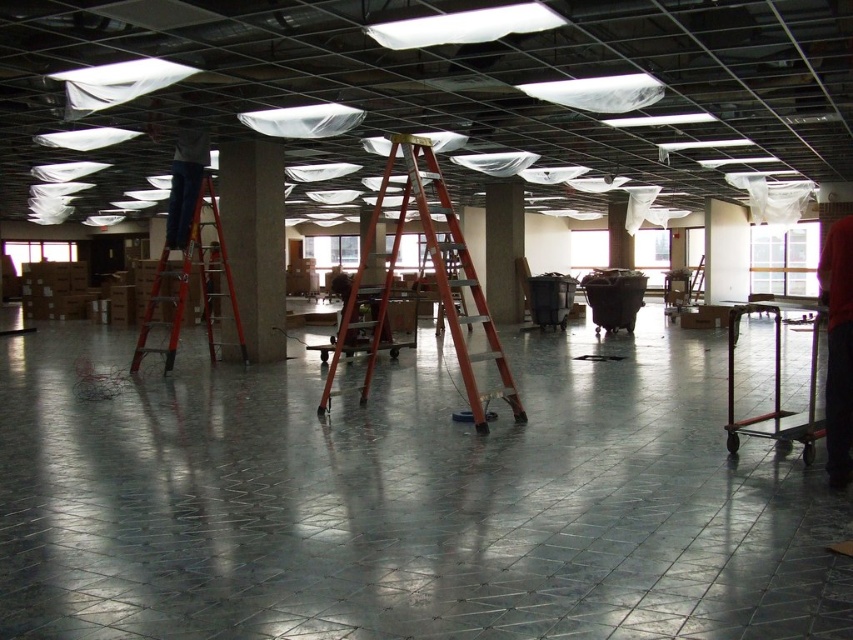
Question: Which point is closer to the camera?

Choices:
 (A) 213,234
 (B) 619,262

Answer: (A)

Question: Which point is farther to the camera?

Choices:
 (A) (450, 301)
 (B) (734, 424)
 (C) (630, 260)

Answer: (C)

Question: Based on their relative distances, which object is nearer to the white glossy pillar at center?

Choices:
 (A) orange metallic ladder at center
 (B) red fabric shirt at right
 (C) metallic cart at center

Answer: (C)

Question: Is orange metallic ladder at center above concrete at center?

Choices:
 (A) no
 (B) yes

Answer: (B)

Question: Is concrete at center closer to camera compared to red plastic ladder at left?

Choices:
 (A) no
 (B) yes

Answer: (A)

Question: Can you confirm if metallic cart at center is positioned to the right of white glossy pillar at center?

Choices:
 (A) no
 (B) yes

Answer: (B)